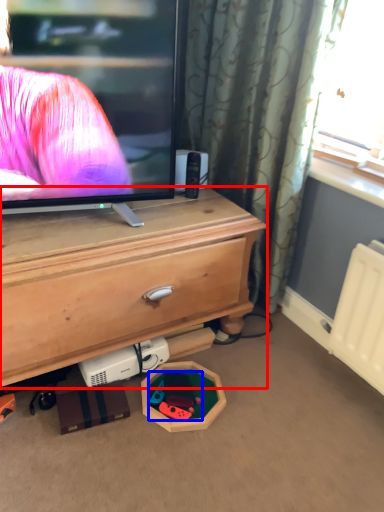
Question: Which point is closer to the camera, chest of drawers (highlighted by a red box) or toy (highlighted by a blue box)?

Choices:
 (A) chest of drawers
 (B) toy

Answer: (A)